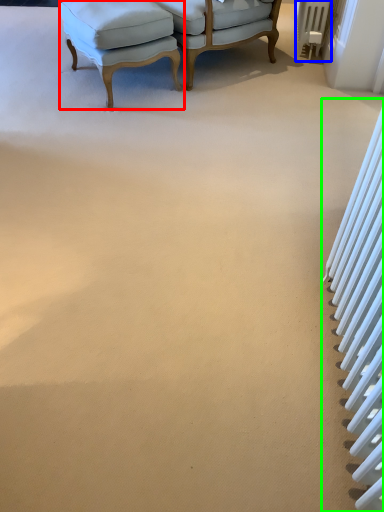
Question: Considering the real-world distances, which object is closest to chair (highlighted by a red box)? radiator (highlighted by a blue box) or radiator (highlighted by a green box).

Choices:
 (A) radiator
 (B) radiator

Answer: (A)